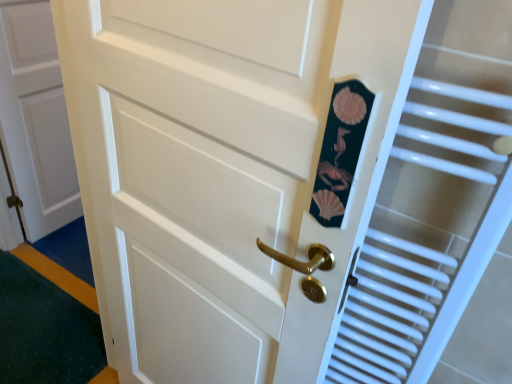
Question: Considering the positions of white plastic radiator at right and white matte door at left in the image, is white plastic radiator at right taller or shorter than white matte door at left?

Choices:
 (A) short
 (B) tall

Answer: (A)

Question: Is white plastic radiator at right wider or thinner than white matte door at left?

Choices:
 (A) thin
 (B) wide

Answer: (B)

Question: Considering their positions, is white plastic radiator at right located in front of or behind white matte door at left?

Choices:
 (A) behind
 (B) front

Answer: (B)

Question: Is white matte door at left taller or shorter than white plastic radiator at right?

Choices:
 (A) tall
 (B) short

Answer: (A)

Question: In the image, is white matte door at left on the left side or the right side of white plastic radiator at right?

Choices:
 (A) right
 (B) left

Answer: (B)

Question: From the image's perspective, is white matte door at left located above or below white plastic radiator at right?

Choices:
 (A) above
 (B) below

Answer: (A)

Question: Is white matte door at left inside or outside of white plastic radiator at right?

Choices:
 (A) outside
 (B) inside

Answer: (A)